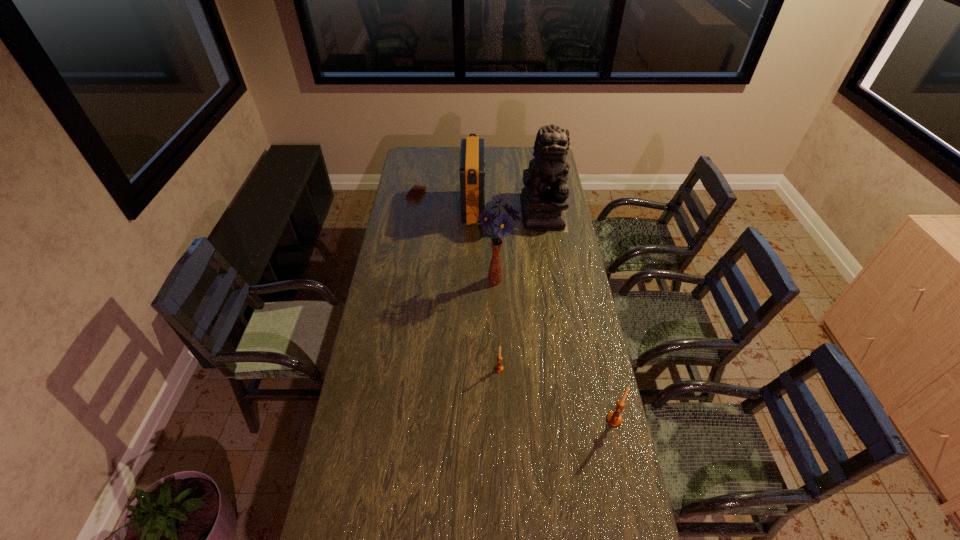
At what (x,y) coordinates should I click in order to perform the action: click on the farther candle_holder. Please return your answer as a coordinate pair (x, y). Looking at the image, I should click on (498, 368).

This screenshot has height=540, width=960. I want to click on the second nearest object, so click(498, 368).

Identify the location of the taller candle_holder. This screenshot has width=960, height=540. (613, 418).

Locate an element on the screen. the nearer candle_holder is located at coordinates (613, 418).

Identify the location of candy bar. (416, 192).

This screenshot has width=960, height=540. Identify the location of the leftmost object. (416, 192).

Image resolution: width=960 pixels, height=540 pixels. In order to click on flower arrangement in this screenshot , I will do `click(502, 225)`.

Where is `the third tallest object`? The width and height of the screenshot is (960, 540). the third tallest object is located at coordinates (472, 162).

The width and height of the screenshot is (960, 540). I want to click on sculpture, so pos(544,198).

This screenshot has height=540, width=960. I want to click on vacant point located 0.100m on the back of the second nearest object, so click(498, 342).